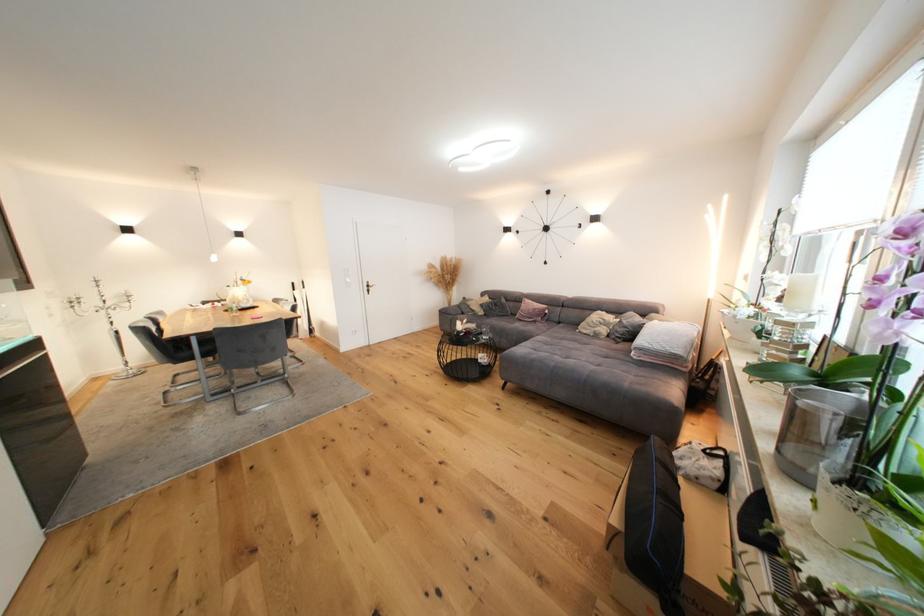
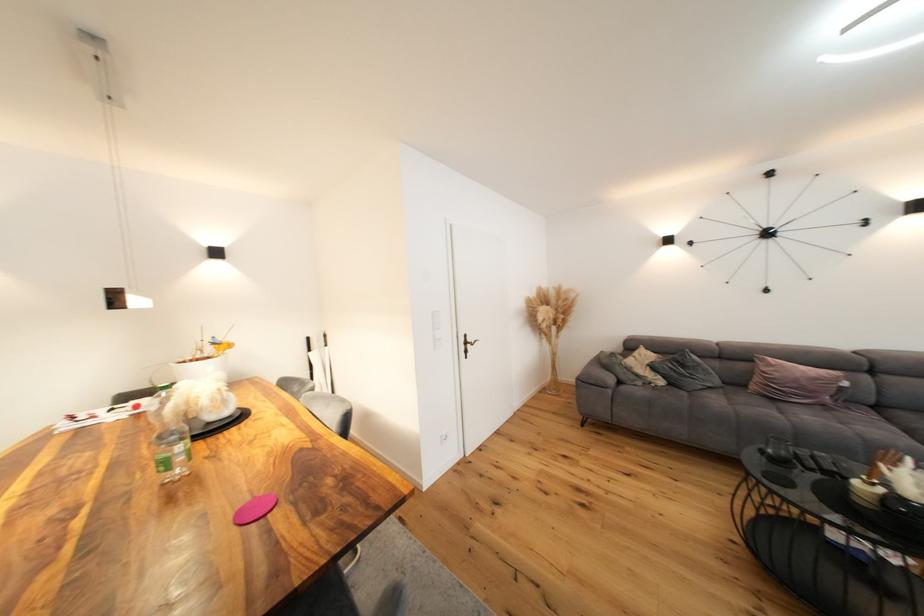
In the second image, find the point that corresponds to (476,308) in the first image.

(637, 371)